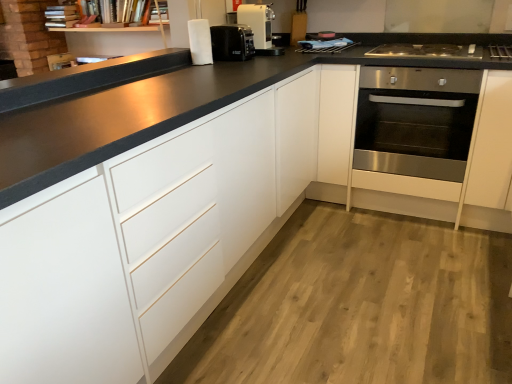
Question: Considering their positions, is stainless steel gas stove at right located in front of or behind black plastic coffee machine at upper center?

Choices:
 (A) behind
 (B) front

Answer: (B)

Question: From the image's perspective, is stainless steel gas stove at right above or below black plastic coffee machine at upper center?

Choices:
 (A) above
 (B) below

Answer: (B)

Question: Which is farther from the black plastic coffee machine at upper center?

Choices:
 (A) white matte cabinet at left
 (B) stainless steel gas stove at right
 (C) stainless steel oven at right
 (D) white plastic coffee machine at upper center

Answer: (A)

Question: Based on their relative distances, which object is farther from the white matte cabinet at left?

Choices:
 (A) white plastic coffee machine at upper center
 (B) black plastic coffee machine at upper center
 (C) stainless steel gas stove at right
 (D) stainless steel oven at right

Answer: (C)